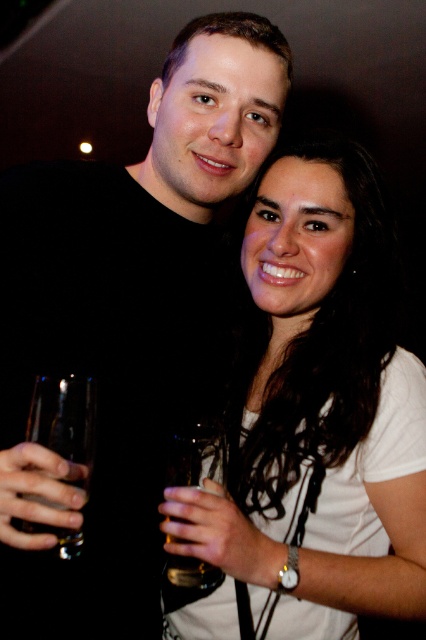
From the picture: Does white matte shirt at center have a lesser width compared to translucent glass at center?

No.

Is point (377, 600) closer to viewer compared to point (213, 440)?

That is True.

I want to click on white matte shirt at center, so click(x=311, y=422).

Which of these two, matte black shirt at center or white matte shirt at center, stands shorter?

Standing shorter between the two is white matte shirt at center.

Can you confirm if matte black shirt at center is smaller than white matte shirt at center?

No, matte black shirt at center is not smaller than white matte shirt at center.

Between point (115, 289) and point (255, 355), which one is positioned in front?

Point (115, 289) is more forward.

This screenshot has height=640, width=426. I want to click on matte black shirt at center, so click(124, 323).

Does matte black shirt at center have a greater width compared to clear glass wine glass at left?

Correct, the width of matte black shirt at center exceeds that of clear glass wine glass at left.

Which is more to the left, matte black shirt at center or clear glass wine glass at left?

matte black shirt at center is more to the left.

What do you see at coordinates (124, 323) in the screenshot?
I see `matte black shirt at center` at bounding box center [124, 323].

What are the coordinates of `matte black shirt at center` in the screenshot? It's located at (124, 323).